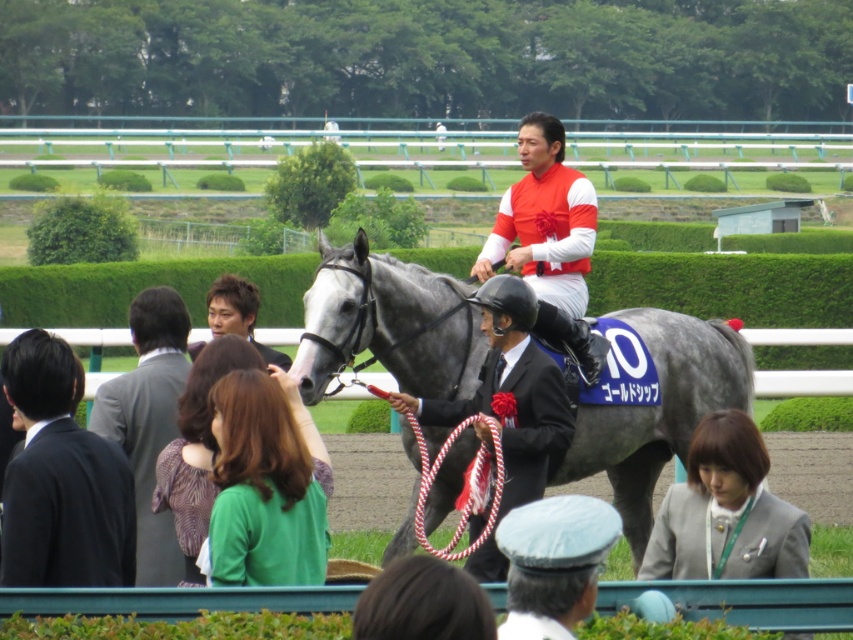
Which of these two, black suit at left or gray suit at center, stands taller?

With more height is black suit at left.

Does black suit at left have a lesser width compared to gray suit at center?

No.

Does point (74, 534) lie behind point (142, 536)?

No.

Find the location of `black suit at left`. black suit at left is located at coordinates (61, 481).

Who is higher up, black glossy suit at center or gray suit at center?

gray suit at center is above.

Between black glossy suit at center and gray suit at center, which one has less height?

Standing shorter between the two is gray suit at center.

Identify the location of black glossy suit at center. (509, 392).

Does black glossy suit at center come in front of matte orange jersey at center?

Yes, it is.

In order to click on black glossy suit at center in this screenshot , I will do `click(509, 392)`.